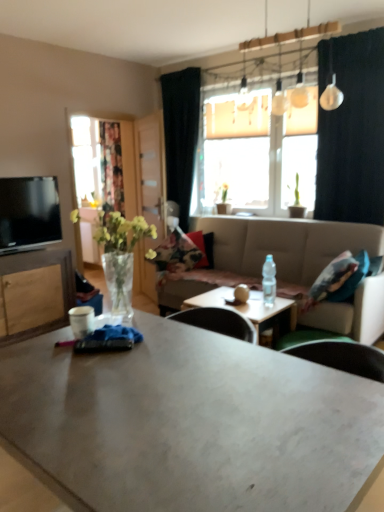
Locate an element on the screen. free space above matte gray coffee table at center, which appears as the second coffee table when viewed from the back (from a real-world perspective) is located at coordinates (168, 391).